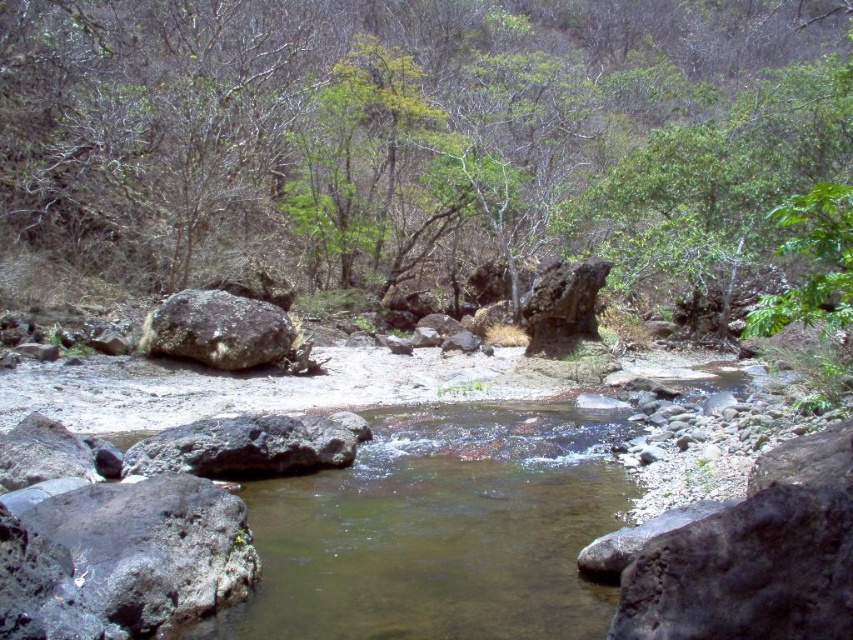
Question: Considering the relative positions of clear water at center and gray rough rock at lower left in the image provided, where is clear water at center located with respect to gray rough rock at lower left?

Choices:
 (A) right
 (B) left

Answer: (A)

Question: Does gray rough rock at lower left have a larger size compared to rusty metallic boulder at left?

Choices:
 (A) yes
 (B) no

Answer: (B)

Question: Which object is the closest to the dark gray rock at center?

Choices:
 (A) green leafy tree at center
 (B) gray rough rock at lower left
 (C) rusty metallic boulder at left
 (D) clear water at center

Answer: (D)

Question: Which point is closer to the camera taking this photo?

Choices:
 (A) (241, 429)
 (B) (16, 582)
 (C) (468, 205)
 (D) (345, 605)

Answer: (B)

Question: Which point is farther to the camera?

Choices:
 (A) rusty metallic boulder at left
 (B) green leafy tree at center
 (C) gray rough rock at lower left
 (D) dark gray rock at center

Answer: (B)

Question: Can you confirm if clear water at center is thinner than rusty metallic boulder at left?

Choices:
 (A) yes
 (B) no

Answer: (B)